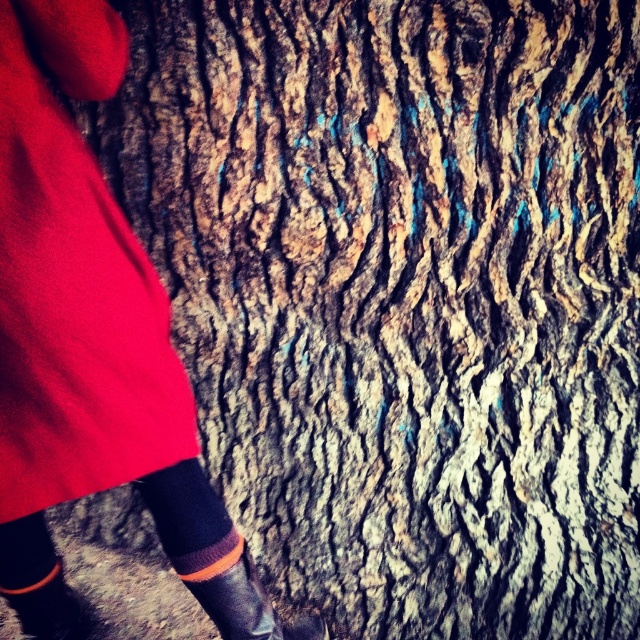
You are a photographer trying to capture the texture of the tree trunk. You notice the matte red fabric at left and the rubber boot at lower left in your frame. Which object is closer to the camera?

The matte red fabric at left is closer to the camera because it is in front of the rubber boot at lower left.

In the scene shown: You are standing in front of the tree trunk and want to touch the matte red fabric at left. Based on its coordinates, where should you move your hand to reach it?

The matte red fabric at left is located at coordinates point (74, 282), so you should move your hand to that point to reach it.